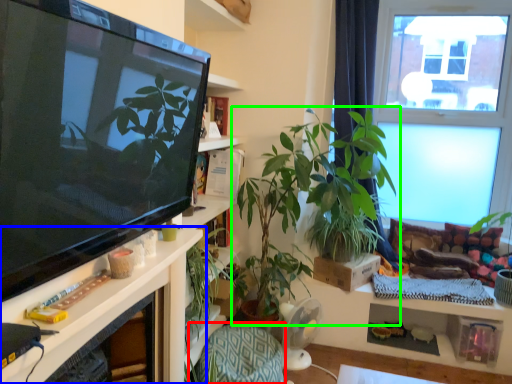
Question: Which is farther away from armchair (highlighted by a red box)? shelf (highlighted by a blue box) or houseplant (highlighted by a green box)?

Choices:
 (A) shelf
 (B) houseplant

Answer: (B)